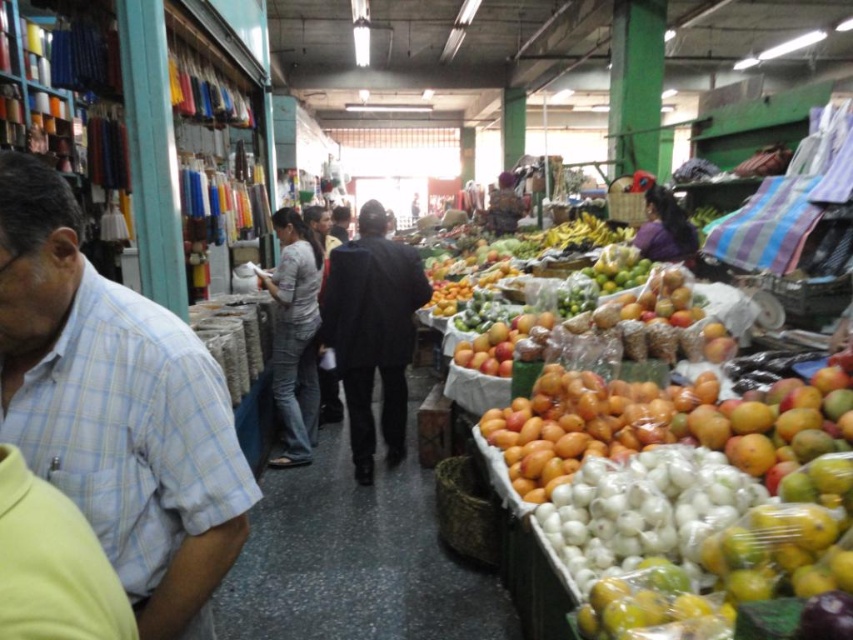
You are a photographer who wants to take a picture of the light blue plaid shirt at left without getting too close to the camera. What is the minimum distance you need to maintain between yourself and the camera to avoid being in the shot?

The minimum distance you need to maintain between yourself and the camera is just over 89.89 centimeters to avoid being in the shot, as the light blue plaid shirt at left is 89.89 centimeters away from the camera.

You are a customer in the market and want to reach the produce section. You are currently standing at point (793, 403). There is an obstacle at point (463, 429). Can you walk directly to the produce section without going around the obstacle?

The obstacle at point (463, 429) is behind your current position at point (793, 403), so you can walk directly to the produce section without needing to go around it.